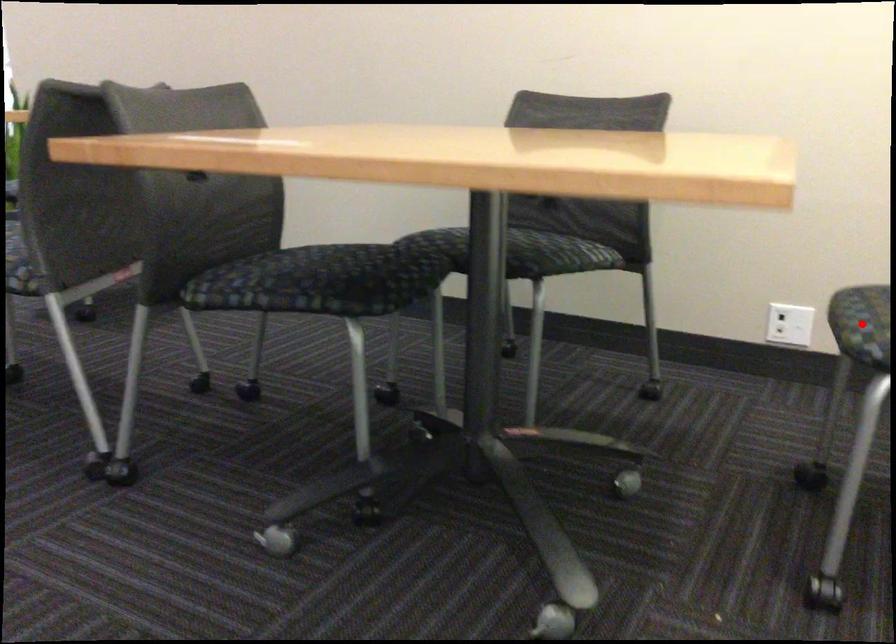
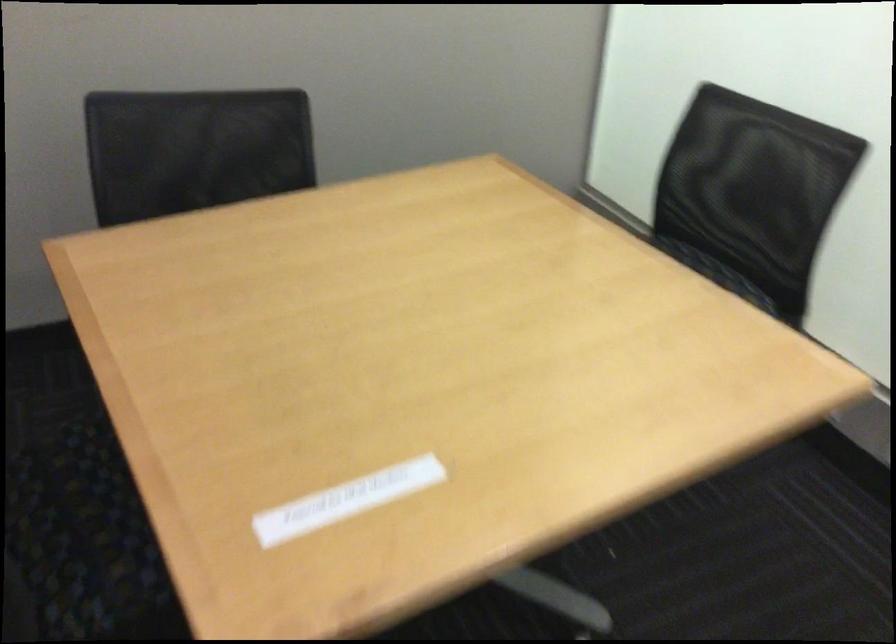
Question: I am providing you with two images of the same scene from different viewpoints. A red point is marked on the first image. At the location where the point appears in image 1, is it still visible in image 2?

Choices:
 (A) Yes
 (B) No

Answer: (B)